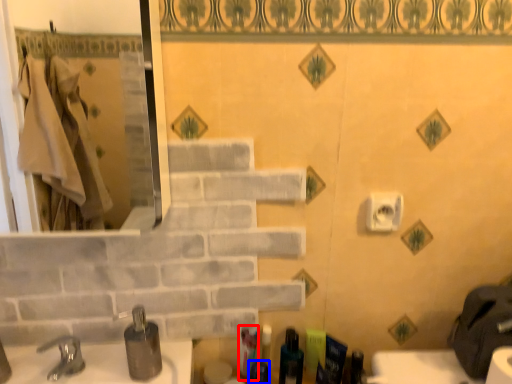
Question: Which object appears farthest to the camera in this image, toiletry (highlighted by a red box) or toiletry (highlighted by a blue box)?

Choices:
 (A) toiletry
 (B) toiletry

Answer: (A)